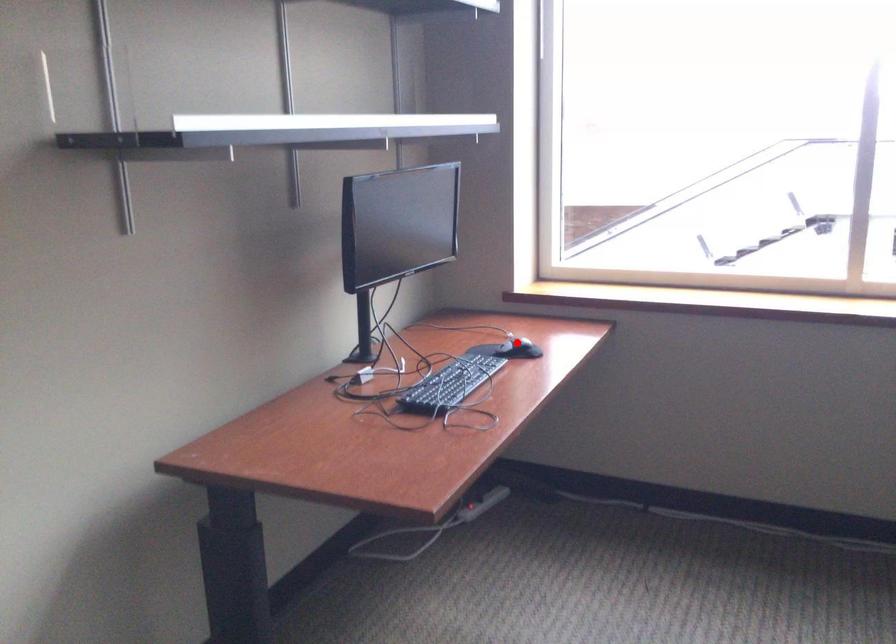
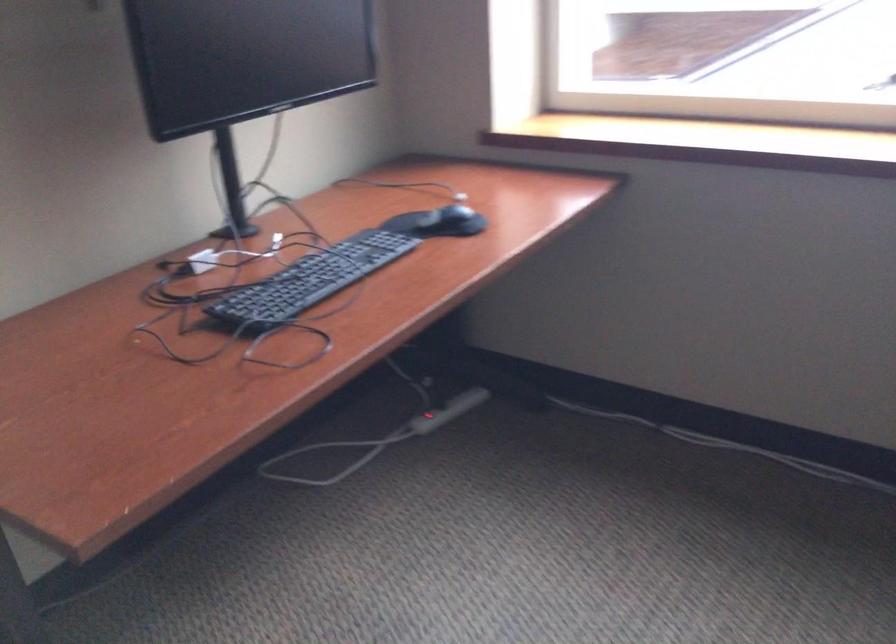
Question: I am providing you with two images of the same scene from different viewpoints. Image1 has a red point marked. In image2, the corresponding 3D location appears at what relative position? Reply with the corresponding letter.

Choices:
 (A) Closer
 (B) Farther

Answer: (A)